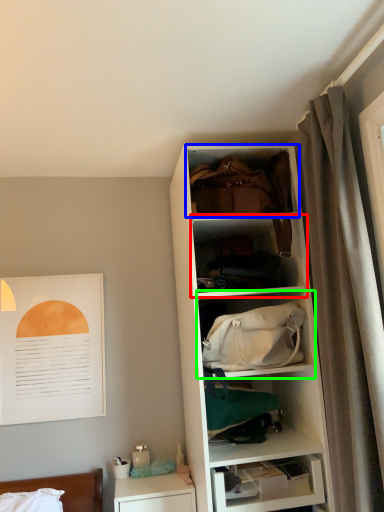
Question: Which object is positioned farthest from shelf (highlighted by a red box)? Select from cabinet (highlighted by a blue box) and shelf (highlighted by a green box).

Choices:
 (A) cabinet
 (B) shelf

Answer: (B)